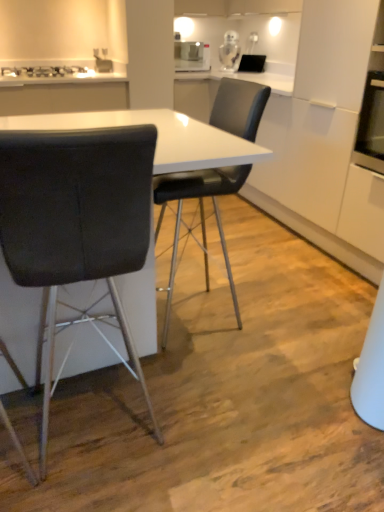
Question: Can you confirm if black leather chair at left, which is the second chair in right-to-left order, is bigger than black leather chair at center, which is the 1th chair from right to left?

Choices:
 (A) no
 (B) yes

Answer: (A)

Question: Is black leather chair at left, which is counted as the first chair, starting from the left, facing towards black leather chair at center, which ranks as the 2th chair in left-to-right order?

Choices:
 (A) yes
 (B) no

Answer: (B)

Question: From the image's perspective, is black leather chair at left, which is the second chair in right-to-left order, on top of black leather chair at center, which is the 1th chair from right to left?

Choices:
 (A) yes
 (B) no

Answer: (B)

Question: Is black leather chair at left, which is the second chair in right-to-left order, smaller than black leather chair at center, which is the 1th chair from right to left?

Choices:
 (A) yes
 (B) no

Answer: (A)

Question: Is black leather chair at left, which is the second chair in right-to-left order, taller than black leather chair at center, which is the 1th chair from right to left?

Choices:
 (A) yes
 (B) no

Answer: (B)

Question: From the image's perspective, is black leather chair at left, which is counted as the first chair, starting from the left, located beneath black leather chair at center, which ranks as the 2th chair in left-to-right order?

Choices:
 (A) yes
 (B) no

Answer: (A)

Question: Is black leather chair at left, which is the second chair in right-to-left order, behind metallic silver gas stove at upper left?

Choices:
 (A) no
 (B) yes

Answer: (A)

Question: Would you consider black leather chair at left, which is the second chair in right-to-left order, to be distant from metallic silver gas stove at upper left?

Choices:
 (A) no
 (B) yes

Answer: (B)

Question: From a real-world perspective, does black leather chair at left, which is counted as the first chair, starting from the left, stand above metallic silver gas stove at upper left?

Choices:
 (A) yes
 (B) no

Answer: (B)

Question: Does black leather chair at left, which is the second chair in right-to-left order, have a greater width compared to metallic silver gas stove at upper left?

Choices:
 (A) yes
 (B) no

Answer: (A)

Question: Considering the relative sizes of black leather chair at left, which is counted as the first chair, starting from the left, and metallic silver gas stove at upper left in the image provided, is black leather chair at left, which is counted as the first chair, starting from the left, shorter than metallic silver gas stove at upper left?

Choices:
 (A) yes
 (B) no

Answer: (B)

Question: Does black leather chair at left, which is counted as the first chair, starting from the left, have a smaller size compared to metallic silver gas stove at upper left?

Choices:
 (A) yes
 (B) no

Answer: (B)

Question: Are black leather chair at center, which ranks as the 2th chair in left-to-right order, and metallic silver gas stove at upper left located far from each other?

Choices:
 (A) no
 (B) yes

Answer: (B)